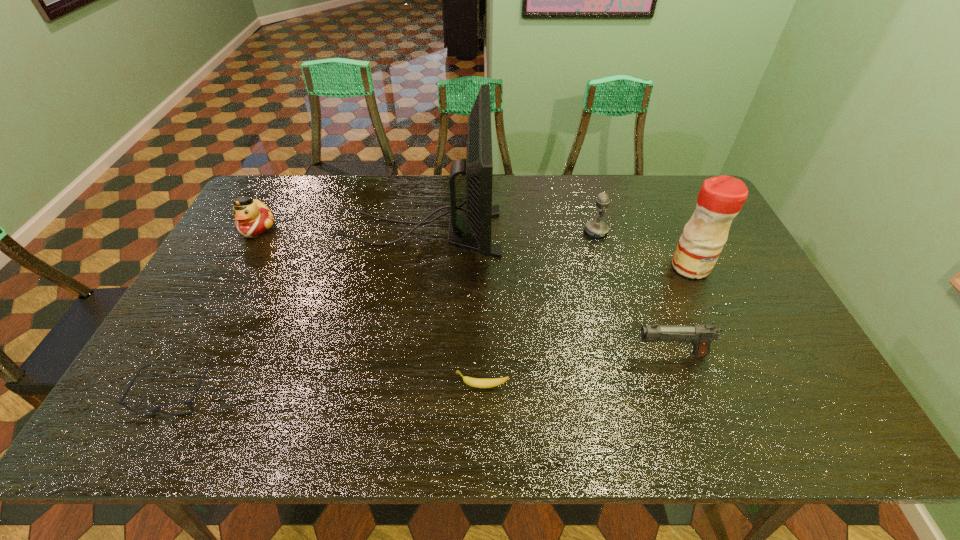
I want to click on computer monitor present at the far edge, so click(x=478, y=166).

Where is `duck that is positioned at the far edge`? The image size is (960, 540). duck that is positioned at the far edge is located at coordinates (252, 218).

At what (x,y) coordinates should I click in order to perform the action: click on object that is at the near edge. Please return your answer as a coordinate pair (x, y). The width and height of the screenshot is (960, 540). Looking at the image, I should click on (156, 409).

Identify the location of duck present at the left edge. (252, 218).

You are a GUI agent. You are given a task and a screenshot of the screen. Output one action in this format:
    pyautogui.click(x=<x>, y=<y>)
    Task: Click on the spectacles at the left edge
    This screenshot has height=540, width=960.
    Given the screenshot: What is the action you would take?
    coord(156,409)

At what (x,y) coordinates should I click in order to perform the action: click on object positioned at the right edge. Please return your answer as a coordinate pair (x, y). Looking at the image, I should click on (720, 199).

Where is `object located in the far left corner section of the desktop`? Image resolution: width=960 pixels, height=540 pixels. object located in the far left corner section of the desktop is located at coordinates (252, 218).

This screenshot has height=540, width=960. Identify the location of object that is at the near left corner. (156, 409).

In the image, there is a desktop. Identify the location of vacant space at the far edge. (508, 203).

Identify the location of free region at the near edge of the desktop. This screenshot has width=960, height=540. (756, 413).